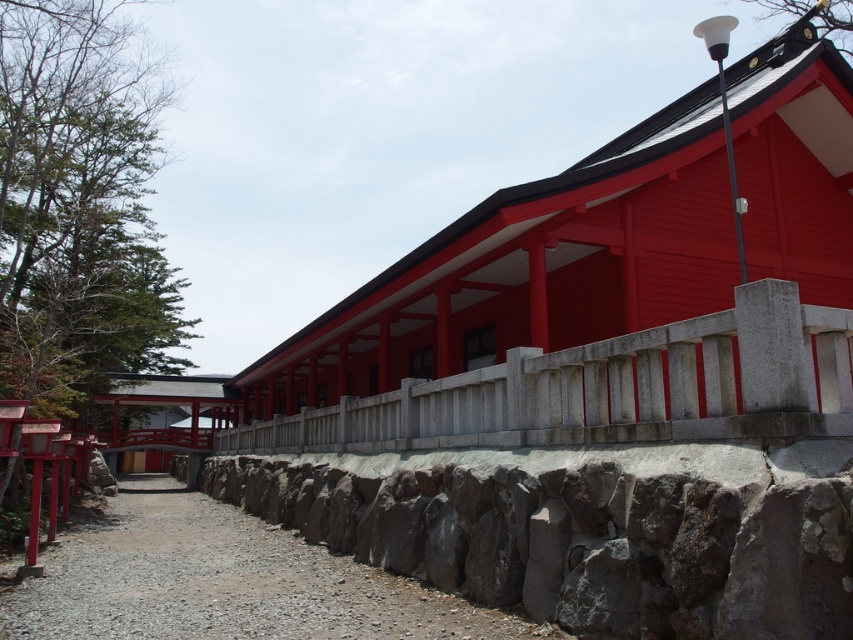
You are standing in front of the traditional Japanese building and want to take a photo of the gray rough stone wall at center. Where should you position yourself to capture the wall in the frame?

The gray rough stone wall at center is located at the center of the image at point coordinates [585,536], so you should position yourself directly in front of the building to capture the wall in the frame.

You are standing in front of a traditional Japanese shrine and want to take a photo of the gray rough stone wall at center. If your camera can focus on objects up to 3 meters away, will you be able to capture the wall clearly?

The gray rough stone wall at center is 3.32 meters away from the viewer. Since the camera can only focus up to 3 meters, you will not be able to capture the wall clearly.